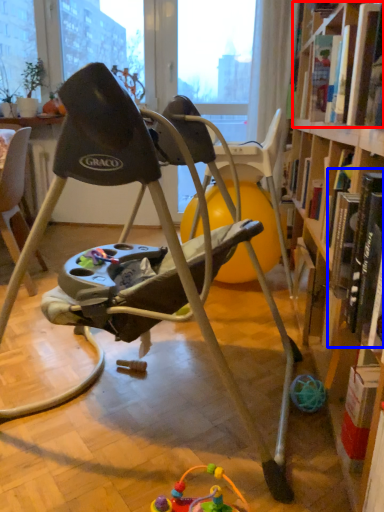
Question: Among these objects, which one is nearest to the camera, book (highlighted by a red box) or book (highlighted by a blue box)?

Choices:
 (A) book
 (B) book

Answer: (B)